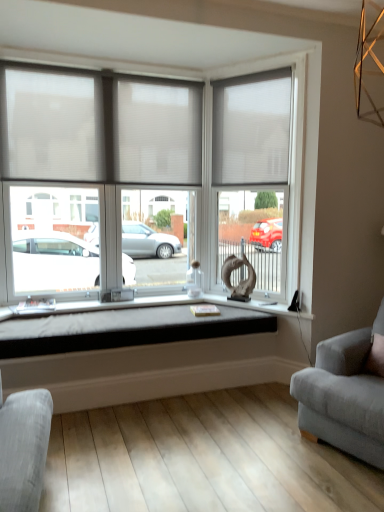
Where is `blank space above translucent fabric window at center (from a real-world perspective)`? The height and width of the screenshot is (512, 384). blank space above translucent fabric window at center (from a real-world perspective) is located at coordinates (96, 64).